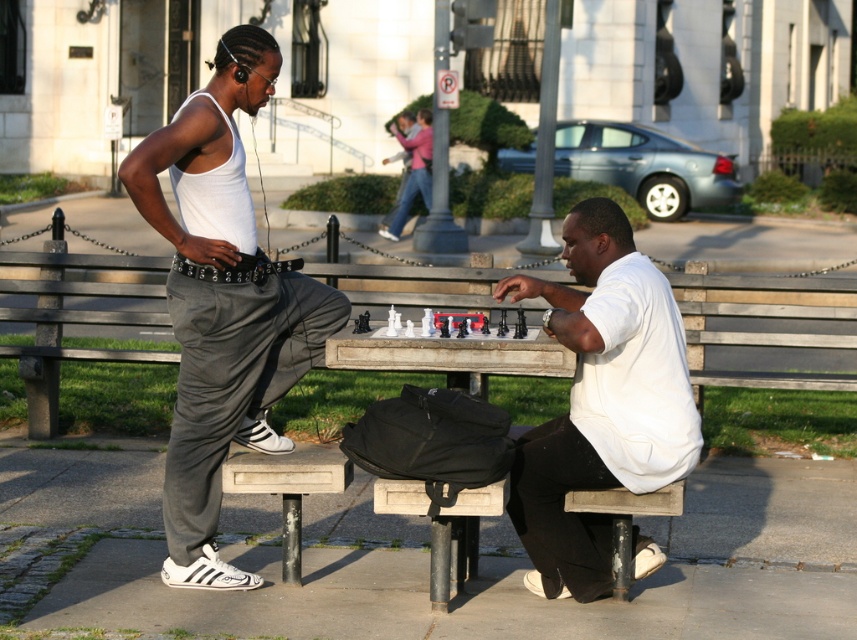
Does white matte shirt at center have a greater width compared to white glossy chess set at center?

Yes.

Can you confirm if white matte shirt at center is thinner than white glossy chess set at center?

Incorrect, white matte shirt at center's width is not less than white glossy chess set at center's.

Between point (577, 205) and point (396, 317), which one is positioned behind?

The point (396, 317) is more distant.

The image size is (857, 640). Find the location of `white matte shirt at center`. white matte shirt at center is located at coordinates click(x=601, y=401).

Consider the image. Which is above, white matte tank top at left or white glossy chess set at center?

white matte tank top at left

Which is behind, point (216, 227) or point (454, 320)?

The point (454, 320) is more distant.

Is point (172, 422) more distant than point (393, 321)?

Yes, point (172, 422) is farther from viewer.

What are the coordinates of `white matte tank top at left` in the screenshot? It's located at [x=222, y=301].

Between white matte tank top at left and pink fabric scarf at upper center, which one has less height?

pink fabric scarf at upper center is shorter.

The width and height of the screenshot is (857, 640). I want to click on white matte tank top at left, so click(222, 301).

Is point (232, 328) less distant than point (421, 189)?

Yes.

This screenshot has height=640, width=857. I want to click on white matte tank top at left, so click(x=222, y=301).